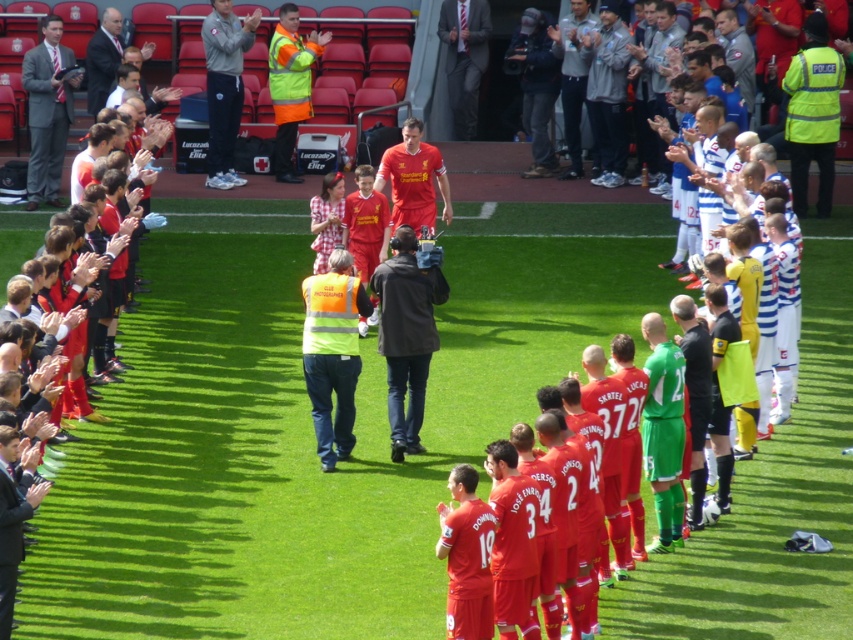
Question: Which of the following is the closest to the observer?

Choices:
 (A) reflective yellow jacket at upper left
 (B) high visibility jacket at center

Answer: (A)

Question: Which object is positioned closest to the dark gray suit at lower left?

Choices:
 (A) high visibility jacket at center
 (B) matte gray suit at upper center
 (C) dark suit at upper left
 (D) matte black suit at left

Answer: (D)

Question: Which of the following is the closest to the observer?

Choices:
 (A) (321, 401)
 (B) (820, 58)
 (C) (227, 45)
 (D) (90, 97)

Answer: (A)

Question: Is reflective yellow jacket at upper left wider than dark suit at upper left?

Choices:
 (A) no
 (B) yes

Answer: (A)

Question: Is dark gray jacket at center thinner than dark gray suit at lower left?

Choices:
 (A) yes
 (B) no

Answer: (B)

Question: Can you confirm if reflective yellow jacket at upper left is positioned above high visibility jacket at center?

Choices:
 (A) yes
 (B) no

Answer: (B)